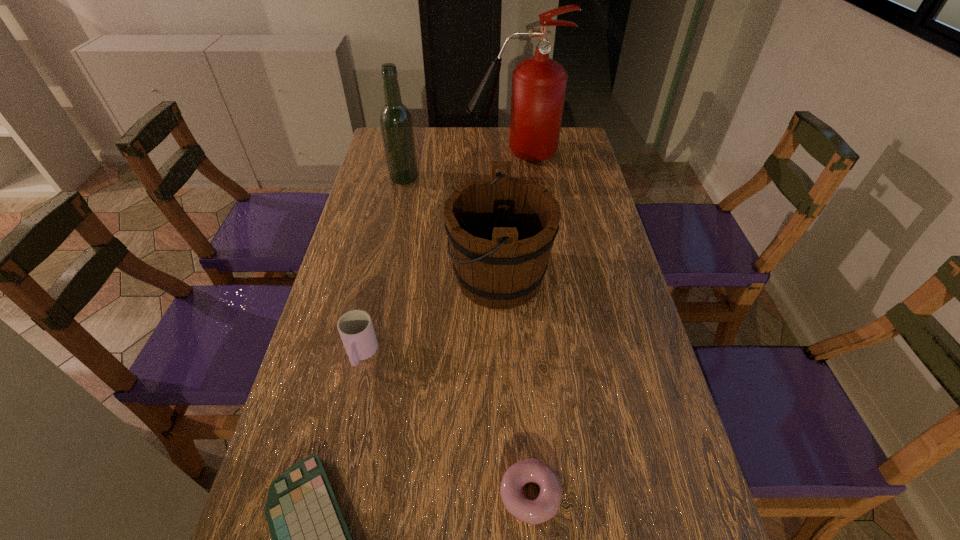
Find the location of a particular element. This screenshot has height=540, width=960. fire extinguisher is located at coordinates (539, 84).

Image resolution: width=960 pixels, height=540 pixels. I want to click on the farthest object, so pos(539,84).

Where is `the second farthest object`? Image resolution: width=960 pixels, height=540 pixels. the second farthest object is located at coordinates (396, 123).

At what (x,y) coordinates should I click in order to perform the action: click on liquor. Please return your answer as a coordinate pair (x, y). This screenshot has width=960, height=540. Looking at the image, I should click on (396, 123).

The width and height of the screenshot is (960, 540). I want to click on the third farthest object, so click(x=501, y=229).

The height and width of the screenshot is (540, 960). Identify the location of the third tallest object. (501, 229).

What are the coordinates of `cup` in the screenshot? It's located at (355, 327).

At what (x,y) coordinates should I click in order to perform the action: click on the third shortest object. Please return your answer as a coordinate pair (x, y). The image size is (960, 540). Looking at the image, I should click on (355, 327).

At what (x,y) coordinates should I click in order to perform the action: click on doughnut. Please return your answer as a coordinate pair (x, y). Looking at the image, I should click on (533, 512).

Where is `vacant space situated with the nozzle aimed from the fire extinguisher`? vacant space situated with the nozzle aimed from the fire extinguisher is located at coordinates (390, 154).